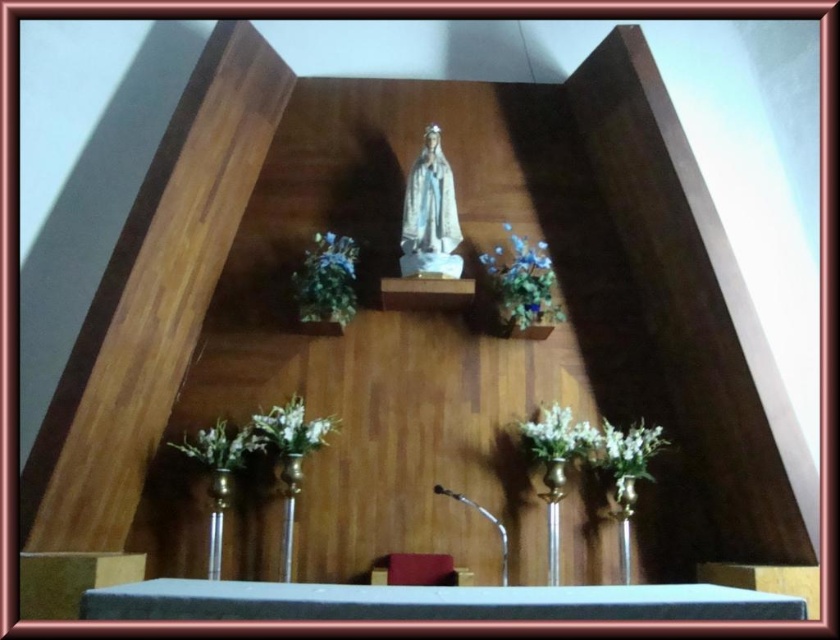
Question: Which object is positioned farthest from the white floral arrangement at lower right?

Choices:
 (A) white matte flower at lower right
 (B) white floral arrangement at lower left

Answer: (B)

Question: Considering the relative positions of silky blue flowers at upper right and white floral arrangement at lower right in the image provided, where is silky blue flowers at upper right located with respect to white floral arrangement at lower right?

Choices:
 (A) below
 (B) above

Answer: (B)

Question: Estimate the real-world distances between objects in this image. Which object is farther from the white matte flowers at center?

Choices:
 (A) white floral arrangement at lower left
 (B) silky blue flowers at upper right
 (C) green leafy plant at upper center
 (D) white floral arrangement at lower right

Answer: (B)

Question: Does silky blue flowers at upper right come behind white matte flower at lower right?

Choices:
 (A) yes
 (B) no

Answer: (A)

Question: Is white matte flowers at center further to camera compared to white matte flower at lower right?

Choices:
 (A) no
 (B) yes

Answer: (A)

Question: Which of these objects is positioned farthest from the white floral arrangement at lower right?

Choices:
 (A) white matte flowers at center
 (B) green leafy plant at upper center
 (C) silky blue flowers at upper right

Answer: (B)